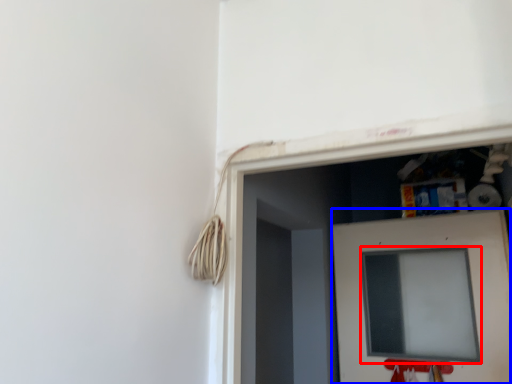
Question: Among these objects, which one is nearest to the camera, computer screen (highlighted by a red box) or door (highlighted by a blue box)?

Choices:
 (A) computer screen
 (B) door

Answer: (B)